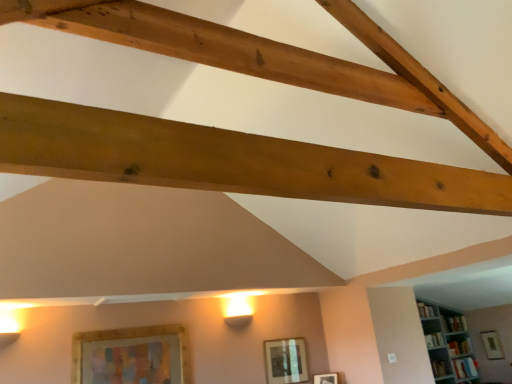
How much space does matte wooden picture frame at center, the 3th picture frame positioned from the front, occupy horizontally?

matte wooden picture frame at center, the 3th picture frame positioned from the front, is 8.57 centimeters in width.

In order to face wooden framed picture at lower left, which appears as the first picture frame when viewed from the front, should I rotate leftwards or rightwards?

A 15.457 degree turn to the left will do.

What do you see at coordinates (492, 345) in the screenshot?
I see `wooden picture frame at upper center, the 1th picture frame when ordered from right to left` at bounding box center [492, 345].

What do you see at coordinates (448, 345) in the screenshot? I see `white wooden bookshelf at upper right` at bounding box center [448, 345].

The image size is (512, 384). What do you see at coordinates (286, 361) in the screenshot?
I see `matte silver picture frame at center, positioned as the 2th picture frame in left-to-right order` at bounding box center [286, 361].

You are a GUI agent. You are given a task and a screenshot of the screen. Output one action in this format:
    pyautogui.click(x=<x>, y=<y>)
    Task: Click on the natural wood beam at upper center
    The image size is (512, 384).
    Given the screenshot: What is the action you would take?
    pyautogui.click(x=227, y=160)

From the image's perspective, which is below, natural wood beam at upper center or wooden picture frame at upper center, the fourth picture frame when ordered from top to bottom?

wooden picture frame at upper center, the fourth picture frame when ordered from top to bottom.

Looking at their sizes, would you say natural wood beam at upper center is wider or thinner than wooden picture frame at upper center, which is the first picture frame in bottom-to-top order?

In the image, natural wood beam at upper center appears to be wider than wooden picture frame at upper center, which is the first picture frame in bottom-to-top order.

Considering the relative positions of natural wood beam at upper center and wooden picture frame at upper center, which appears as the first picture frame when viewed from the back, in the image provided, is natural wood beam at upper center to the left of wooden picture frame at upper center, which appears as the first picture frame when viewed from the back, from the viewer's perspective?

Indeed, natural wood beam at upper center is positioned on the left side of wooden picture frame at upper center, which appears as the first picture frame when viewed from the back.

Which is behind, wooden picture frame at upper center, which appears as the first picture frame when viewed from the back, or matte wooden picture frame at center, marked as the 2th picture frame in a bottom-to-top arrangement?

wooden picture frame at upper center, which appears as the first picture frame when viewed from the back, is further away from the camera.

Is wooden picture frame at upper center, the fourth picture frame in the left-to-right sequence, surrounding matte wooden picture frame at center, placed as the third picture frame when sorted from left to right?

No.

Considering the sizes of objects wooden picture frame at upper center, the fourth picture frame in the left-to-right sequence, and matte wooden picture frame at center, acting as the 3th picture frame starting from the top, in the image provided, who is wider, wooden picture frame at upper center, the fourth picture frame in the left-to-right sequence, or matte wooden picture frame at center, acting as the 3th picture frame starting from the top,?

With larger width is matte wooden picture frame at center, acting as the 3th picture frame starting from the top.

In the scene shown: Can you tell me how much wooden picture frame at upper center, the fourth picture frame in the left-to-right sequence, and matte wooden picture frame at center, acting as the 3th picture frame starting from the top, differ in facing direction?

wooden picture frame at upper center, the fourth picture frame in the left-to-right sequence, and matte wooden picture frame at center, acting as the 3th picture frame starting from the top, are facing 28.9 degrees away from each other.

Who is taller, wooden framed picture at lower left, the 4th picture frame from the bottom, or wooden picture frame at upper center, which is counted as the 4th picture frame, starting from the front?

Standing taller between the two is wooden framed picture at lower left, the 4th picture frame from the bottom.

Is wooden framed picture at lower left, which is the first picture frame from left to right, to the right of wooden picture frame at upper center, which appears as the first picture frame when viewed from the back, from the viewer's perspective?

No, wooden framed picture at lower left, which is the first picture frame from left to right, is not to the right of wooden picture frame at upper center, which appears as the first picture frame when viewed from the back.

Is wooden framed picture at lower left, which is the first picture frame from left to right, aimed at wooden picture frame at upper center, the fourth picture frame when ordered from top to bottom?

No, wooden framed picture at lower left, which is the first picture frame from left to right, is not oriented towards wooden picture frame at upper center, the fourth picture frame when ordered from top to bottom.

Which point is more forward, (120, 345) or (493, 331)?

Point (120, 345)

Do you think white wooden bookshelf at upper right is within matte wooden picture frame at center, placed as the third picture frame when sorted from left to right, or outside of it?

The correct answer is: outside.

From a real-world perspective, is white wooden bookshelf at upper right on matte wooden picture frame at center, the 3th picture frame positioned from the front?

Yes, from a real-world perspective, white wooden bookshelf at upper right is on top of matte wooden picture frame at center, the 3th picture frame positioned from the front.

Can you tell me how much white wooden bookshelf at upper right and matte wooden picture frame at center, positioned as the 2th picture frame in back-to-front order, differ in facing direction?

white wooden bookshelf at upper right and matte wooden picture frame at center, positioned as the 2th picture frame in back-to-front order, are facing 60 degrees away from each other.

From a real-world perspective, is wooden framed picture at lower left, the fourth picture frame positioned from the right, positioned above or below natural wood beam at upper center?

From a real-world perspective, wooden framed picture at lower left, the fourth picture frame positioned from the right, is physically below natural wood beam at upper center.

Is natural wood beam at upper center a part of wooden framed picture at lower left, which appears as the first picture frame when viewed from the front?

No, natural wood beam at upper center is not a part of wooden framed picture at lower left, which appears as the first picture frame when viewed from the front.

Is wooden framed picture at lower left, which is the first picture frame from left to right, touching natural wood beam at upper center?

No, wooden framed picture at lower left, which is the first picture frame from left to right, is not beside natural wood beam at upper center.

Consider the image. Is wooden framed picture at lower left, which appears as the first picture frame when viewed from the front, positioned with its back to natural wood beam at upper center?

wooden framed picture at lower left, which appears as the first picture frame when viewed from the front, does not have its back to natural wood beam at upper center.

Is natural wood beam at upper center placed right next to matte silver picture frame at center, which is the 3th picture frame from right to left?

No, natural wood beam at upper center is not next to matte silver picture frame at center, which is the 3th picture frame from right to left.

Can you confirm if natural wood beam at upper center is wider than matte silver picture frame at center, positioned as the 2th picture frame in left-to-right order?

Indeed, natural wood beam at upper center has a greater width compared to matte silver picture frame at center, positioned as the 2th picture frame in left-to-right order.

Does point (136, 161) come closer to viewer compared to point (298, 378)?

Yes.

This screenshot has height=384, width=512. Identify the location of plank above the matte silver picture frame at center, the 2th picture frame when ordered from front to back (from the image's perspective). (227, 160).

From the image's perspective, is wooden framed picture at lower left, which appears as the first picture frame when viewed from the front, located above matte wooden picture frame at center, the 3th picture frame positioned from the front?

Yes, from the image's perspective, wooden framed picture at lower left, which appears as the first picture frame when viewed from the front, is above matte wooden picture frame at center, the 3th picture frame positioned from the front.

From a real-world perspective, is wooden framed picture at lower left, which is the first picture frame from left to right, below matte wooden picture frame at center, placed as the third picture frame when sorted from left to right?

Incorrect, from a real-world perspective, wooden framed picture at lower left, which is the first picture frame from left to right, is higher than matte wooden picture frame at center, placed as the third picture frame when sorted from left to right.

How different are the orientations of wooden framed picture at lower left, which appears as the first picture frame when viewed from the front, and matte wooden picture frame at center, placed as the third picture frame when sorted from left to right, in degrees?

The angular difference between wooden framed picture at lower left, which appears as the first picture frame when viewed from the front, and matte wooden picture frame at center, placed as the third picture frame when sorted from left to right, is 57.6 degrees.

Relative to matte wooden picture frame at center, positioned as the 2th picture frame in back-to-front order, is wooden framed picture at lower left, the fourth picture frame positioned from the right, in front or behind?

In the image, wooden framed picture at lower left, the fourth picture frame positioned from the right, appears in front of matte wooden picture frame at center, positioned as the 2th picture frame in back-to-front order.

You are a GUI agent. You are given a task and a screenshot of the screen. Output one action in this format:
    pyautogui.click(x=<x>, y=<y>)
    Task: Click on the 4th picture frame behind the natural wood beam at upper center
    The image size is (512, 384).
    Given the screenshot: What is the action you would take?
    pyautogui.click(x=492, y=345)

Locate an element on the screen. Image resolution: width=512 pixels, height=384 pixels. picture frame on the right of matte wooden picture frame at center, placed as the third picture frame when sorted from left to right is located at coordinates (492, 345).

Estimate the real-world distances between objects in this image. Which object is closer to matte silver picture frame at center, acting as the 3th picture frame starting from the back, wooden picture frame at upper center, the fourth picture frame in the left-to-right sequence, or matte wooden picture frame at center, acting as the 3th picture frame starting from the top?

matte wooden picture frame at center, acting as the 3th picture frame starting from the top, lies closer to matte silver picture frame at center, acting as the 3th picture frame starting from the back, than the other object.

Based on their spatial positions, is natural wood beam at upper center or matte silver picture frame at center, the 3th picture frame when ordered from bottom to top, closer to wooden picture frame at upper center, which appears as the first picture frame when viewed from the back?

matte silver picture frame at center, the 3th picture frame when ordered from bottom to top.

When comparing their distances from wooden framed picture at lower left, the fourth picture frame positioned from the right, does natural wood beam at upper center or matte silver picture frame at center, the 3th picture frame when ordered from bottom to top, seem closer?

matte silver picture frame at center, the 3th picture frame when ordered from bottom to top.

When comparing their distances from matte wooden picture frame at center, the 3th picture frame positioned from the front, does wooden framed picture at lower left, the 4th picture frame from the bottom, or white wooden bookshelf at upper right seem further?

The object further to matte wooden picture frame at center, the 3th picture frame positioned from the front, is white wooden bookshelf at upper right.

Looking at the image, which one is located closer to wooden framed picture at lower left, the fourth picture frame viewed from the back, matte silver picture frame at center, the 2th picture frame when ordered from front to back, or white wooden bookshelf at upper right?

Among the two, matte silver picture frame at center, the 2th picture frame when ordered from front to back, is located nearer to wooden framed picture at lower left, the fourth picture frame viewed from the back.

Which object lies further to the anchor point wooden picture frame at upper center, the fourth picture frame in the left-to-right sequence, white wooden bookshelf at upper right or natural wood beam at upper center?

Based on the image, natural wood beam at upper center appears to be further to wooden picture frame at upper center, the fourth picture frame in the left-to-right sequence.

From the image, which object appears to be nearer to natural wood beam at upper center, matte silver picture frame at center, the 2th picture frame when ordered from front to back, or matte wooden picture frame at center, marked as the 2th picture frame in a bottom-to-top arrangement?

Based on the image, matte silver picture frame at center, the 2th picture frame when ordered from front to back, appears to be nearer to natural wood beam at upper center.

Considering their positions, is matte wooden picture frame at center, positioned as the 2th picture frame in back-to-front order, positioned further to wooden framed picture at lower left, which appears as the first picture frame when viewed from the front, than matte silver picture frame at center, which is the 3th picture frame from right to left?

Based on the image, matte wooden picture frame at center, positioned as the 2th picture frame in back-to-front order, appears to be further to wooden framed picture at lower left, which appears as the first picture frame when viewed from the front.

Identify the location of picture frame between matte silver picture frame at center, which is the 3th picture frame from right to left, and white wooden bookshelf at upper right from left to right. The width and height of the screenshot is (512, 384). (326, 378).

At what (x,y) coordinates should I click in order to perform the action: click on picture frame between wooden framed picture at lower left, acting as the first picture frame starting from the top, and matte wooden picture frame at center, which ranks as the 2th picture frame in right-to-left order, in the horizontal direction. Please return your answer as a coordinate pair (x, y). The image size is (512, 384). Looking at the image, I should click on (286, 361).

Image resolution: width=512 pixels, height=384 pixels. I want to click on picture frame between natural wood beam at upper center and matte silver picture frame at center, which is the 3th picture frame from right to left, along the z-axis, so point(132,356).

The image size is (512, 384). What are the coordinates of `shelf between wooden framed picture at lower left, the fourth picture frame positioned from the right, and wooden picture frame at upper center, which is counted as the 4th picture frame, starting from the front` in the screenshot? It's located at (448, 345).